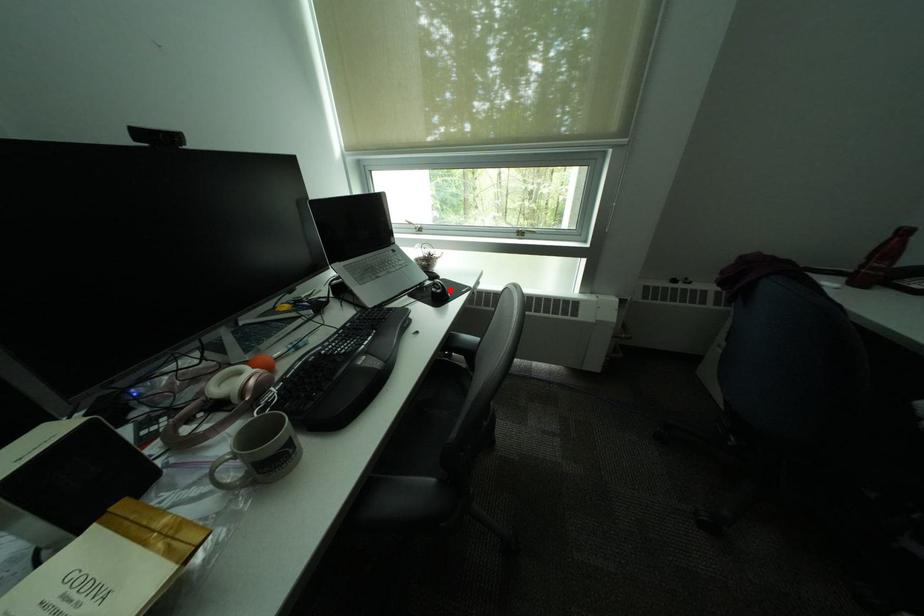
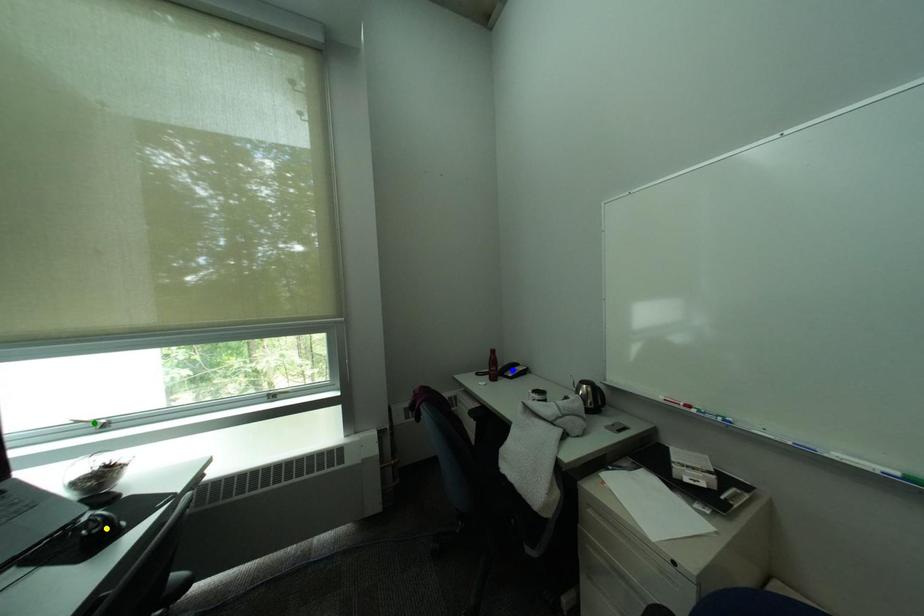
Question: I am providing you with two images of the same scene from different viewpoints. A red point is marked on the first image. You are given multiple points on the second image. Which point in image 2 represents the same 3d spot as the red point in image 1?

Choices:
 (A) green point
 (B) blue point
 (C) yellow point

Answer: (C)